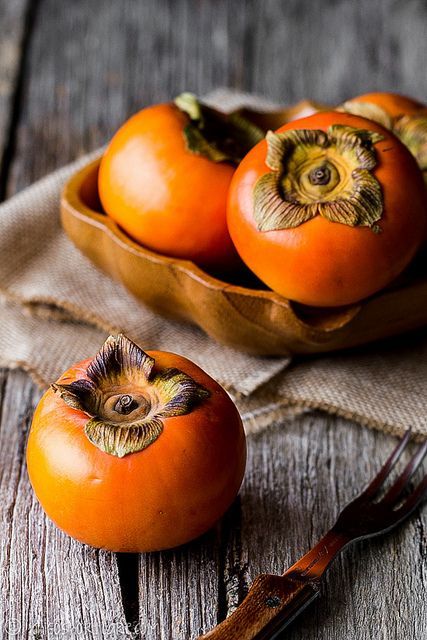
Find the location of a particular element. Image resolution: width=427 pixels, height=640 pixels. woven placemat is located at coordinates (350, 387).